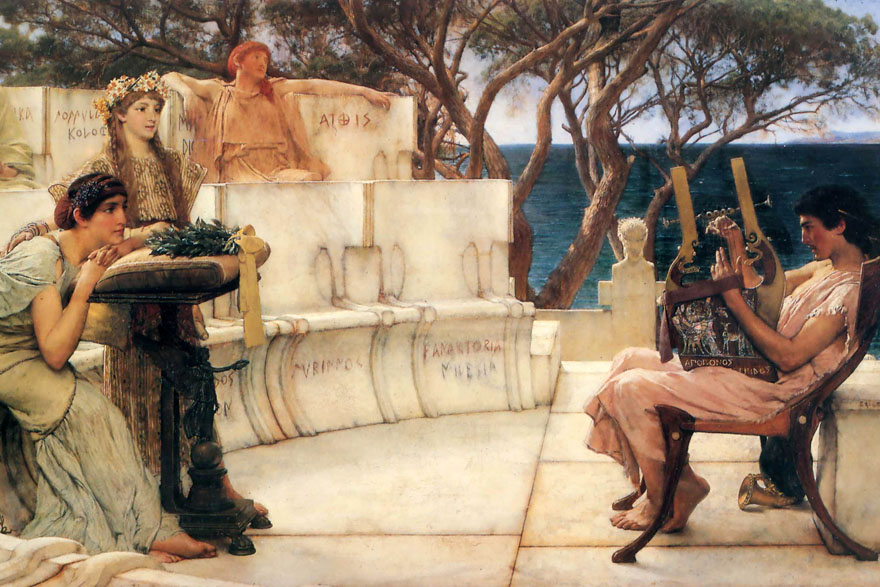
Find the location of a particular element. The width and height of the screenshot is (880, 587). table pedistal is located at coordinates tap(171, 401).